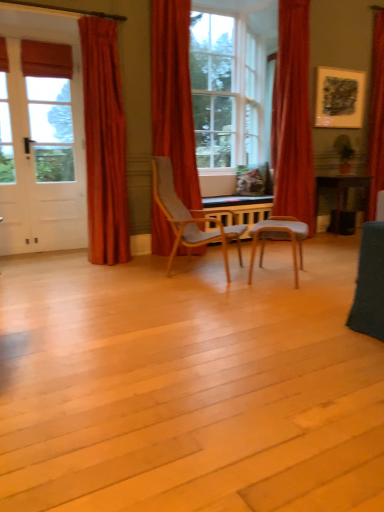
Question: In the image, is velvet red curtain at right, the 3th curtain viewed from the left, positioned in front of or behind velvet red curtain at center, the 3th curtain positioned from the right?

Choices:
 (A) front
 (B) behind

Answer: (B)

Question: Considering the positions of point (301, 175) and point (155, 202), is point (301, 175) closer or farther from the camera than point (155, 202)?

Choices:
 (A) farther
 (B) closer

Answer: (A)

Question: Estimate the real-world distances between objects in this image. Which object is closer to the matte glass window at center?

Choices:
 (A) velvet red curtain at right, the second curtain positioned from the right
 (B) wooden chair at center, which is the first chair from right to left
 (C) velvet orange curtain at left, which appears as the 1th curtain when viewed from the left
 (D) red velvet curtain at right, the first curtain in the right-to-left sequence
 (E) light gray fabric chair at center, the 2th chair viewed from the right

Answer: (A)

Question: Based on their relative distances, which object is nearer to the wooden chair at center, which is the first chair from right to left?

Choices:
 (A) red velvet curtain at right, which is counted as the 4th curtain, starting from the left
 (B) velvet orange curtain at left, which appears as the 1th curtain when viewed from the left
 (C) light gray fabric chair at center, placed as the first chair when sorted from left to right
 (D) green matte houseplant at upper right
 (E) matte black picture frame at upper right

Answer: (C)